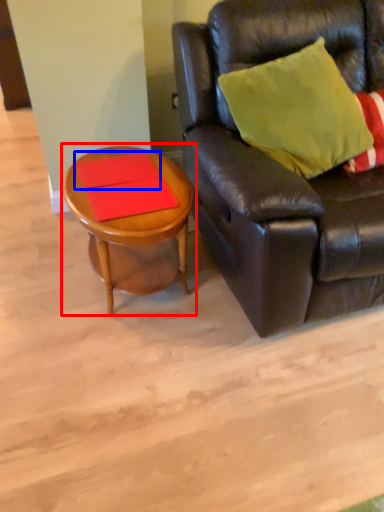
Question: Among these objects, which one is nearest to the camera, coffee table (highlighted by a red box) or plank (highlighted by a blue box)?

Choices:
 (A) coffee table
 (B) plank

Answer: (A)